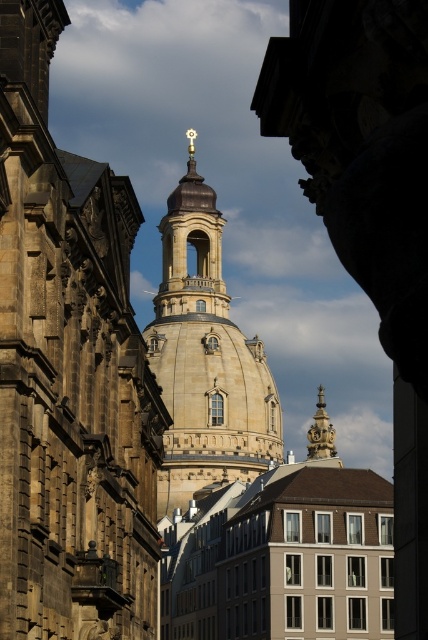
Question: Which point appears closest to the camera in this image?

Choices:
 (A) (162, 492)
 (B) (38, 433)

Answer: (B)

Question: Does stone church at center appear under stone tower at center?

Choices:
 (A) yes
 (B) no

Answer: (A)

Question: Among these points, which one is farthest from the camera?

Choices:
 (A) (2, 99)
 (B) (216, 228)

Answer: (B)

Question: In this image, where is stone church at center located relative to stone tower at center?

Choices:
 (A) left
 (B) right

Answer: (A)

Question: Does stone church at center lie behind stone tower at center?

Choices:
 (A) yes
 (B) no

Answer: (B)